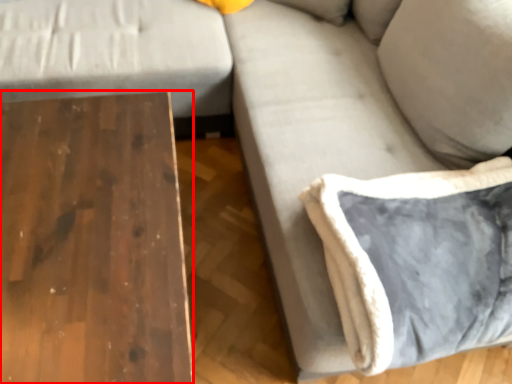
Question: In this image, where is table (annotated by the red box) located relative to pillow?

Choices:
 (A) left
 (B) right

Answer: (A)